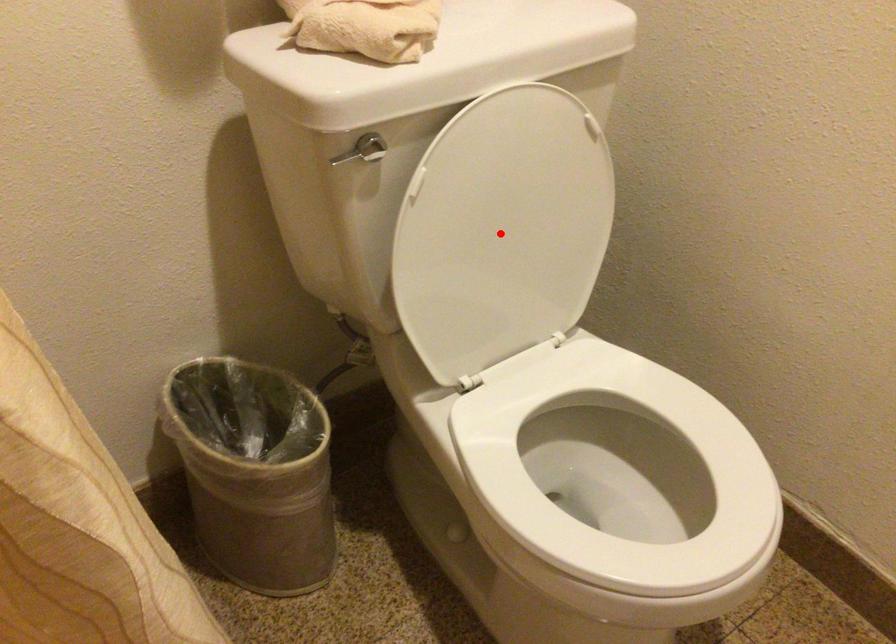
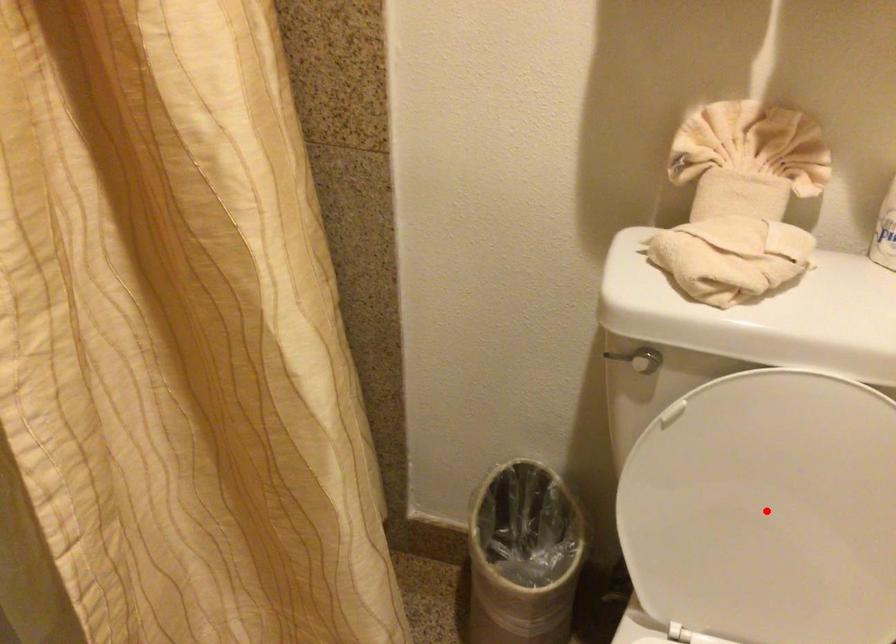
I am providing you with two images of the same scene from different viewpoints. A red point is marked on the first image and another point is marked on the second image. Is the marked point in image1 the same physical position as the marked point in image2?

Yes